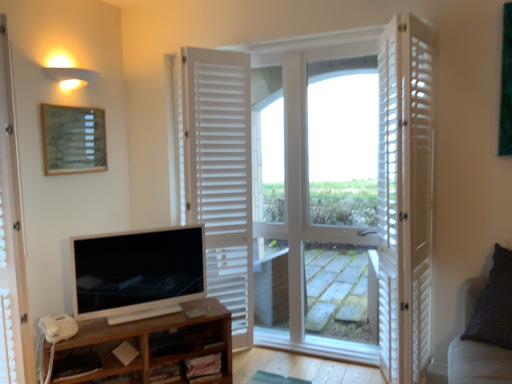
Where is `vacant area that is situated to the right of white plastic phone at lower left`? vacant area that is situated to the right of white plastic phone at lower left is located at coordinates (94, 328).